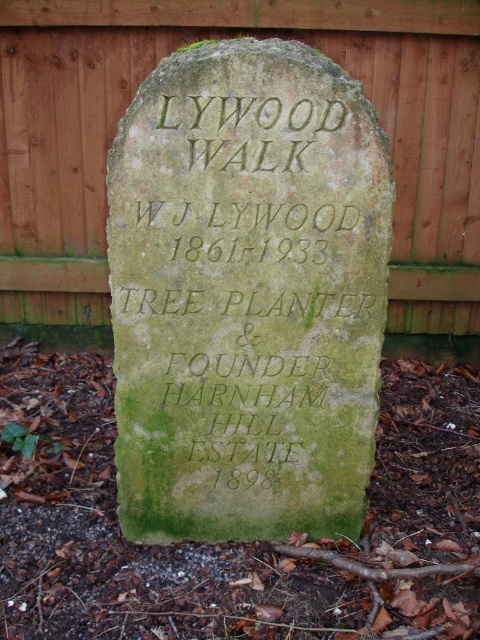
Question: Can you confirm if green mossy stone at center is bigger than wooden fence at upper center?

Choices:
 (A) no
 (B) yes

Answer: (A)

Question: Does green mossy stone at center come behind wooden fence at upper center?

Choices:
 (A) no
 (B) yes

Answer: (A)

Question: Is green mossy stone at center wider than wooden fence at upper center?

Choices:
 (A) yes
 (B) no

Answer: (B)

Question: Among these objects, which one is nearest to the camera?

Choices:
 (A) wooden fence at upper center
 (B) green mossy stone at center

Answer: (B)